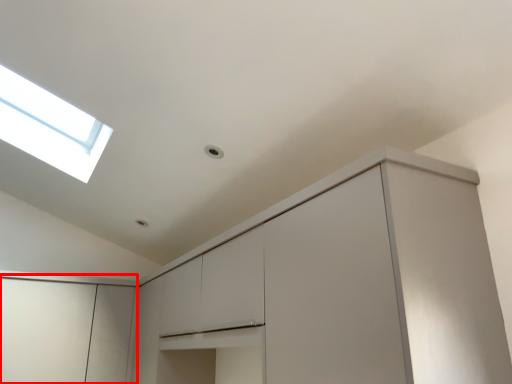
Question: Where is cabinetry (annotated by the red box) located in relation to cabinetry in the image?

Choices:
 (A) left
 (B) right

Answer: (A)